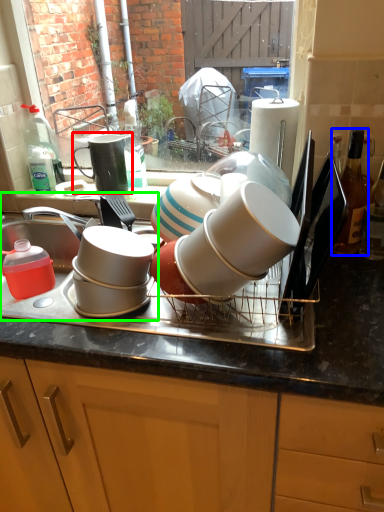
Question: Considering the real-world distances, which object is closest to tableware (highlighted by a red box)? bottle (highlighted by a blue box) or sink (highlighted by a green box).

Choices:
 (A) bottle
 (B) sink

Answer: (B)